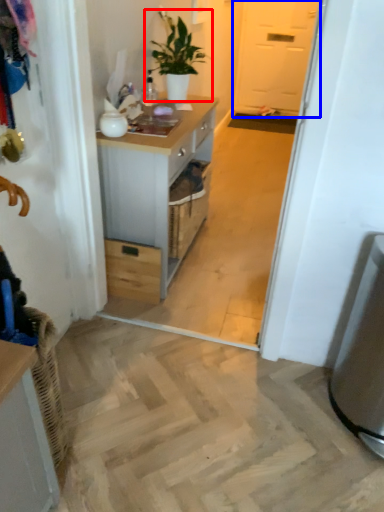
Question: Among these objects, which one is nearest to the camera, houseplant (highlighted by a red box) or screen door (highlighted by a blue box)?

Choices:
 (A) houseplant
 (B) screen door

Answer: (A)